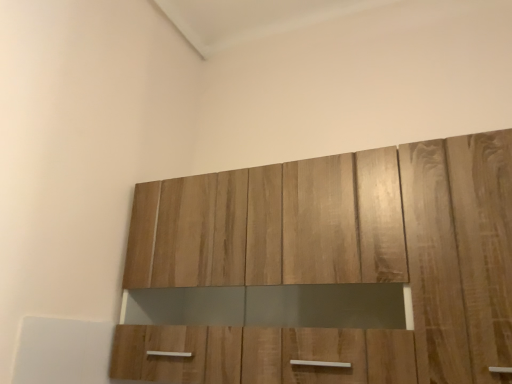
This screenshot has width=512, height=384. Describe the element at coordinates (356, 238) in the screenshot. I see `wooden cabinet at upper center` at that location.

The image size is (512, 384). In order to click on wooden cabinet at upper center in this screenshot , I will do [356, 238].

Identify the location of wooden cabinet at upper center. (356, 238).